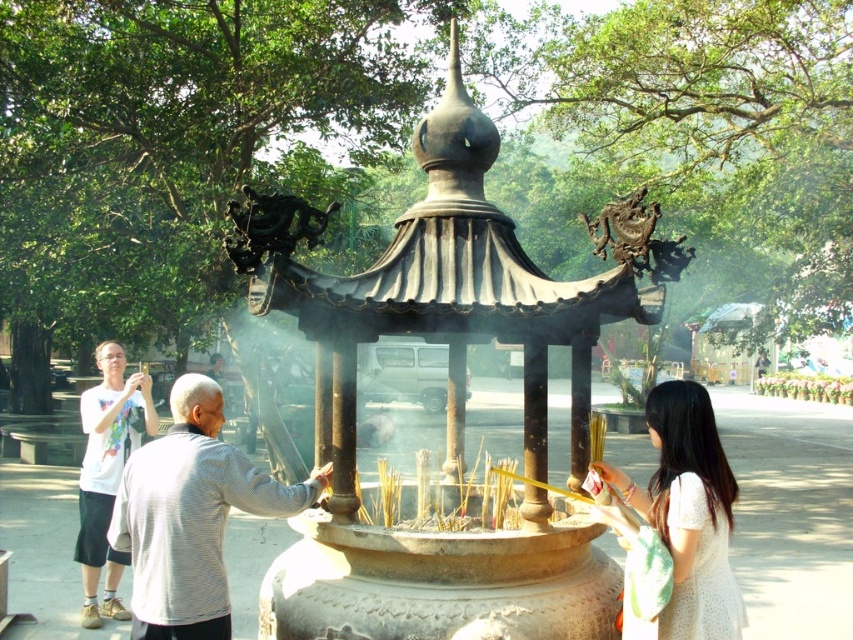
You are a photographer trying to capture a photo of the incense burning scene. You notice two people wearing the gray striped shirt at center and the white cotton shirt at left. Since you want to ensure both are visible in the frame, which person should you position closer to the front to avoid being blocked by others?

The gray striped shirt at center has a lesser height compared to the white cotton shirt at left. To ensure both are visible, position the gray striped shirt at center closer to the front since they are shorter and might be blocked by taller individuals behind.

You are a photographer who wants to capture both the white lace dress at lower right and the white cotton shirt at left in a single frame. However, your camera can only focus on one subject at a time. Which subject should you focus on to ensure the other is still visible in the background?

You should focus on the white lace dress at lower right because it is positioned over the white cotton shirt at left, meaning the shirt will appear in the background and remain visible even if not in focus.